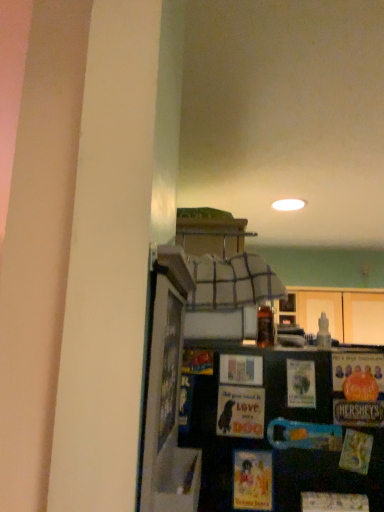
Question: Based on their sizes in the image, would you say matte paper postcard at center, arranged as the 1th postcard when viewed from the left, is bigger or smaller than matte paper postcard at center, marked as the 1th postcard in a right-to-left arrangement?

Choices:
 (A) small
 (B) big

Answer: (B)

Question: Is matte paper postcard at center, arranged as the 1th postcard when viewed from the left, taller or shorter than matte paper postcard at center, the 2th postcard in the left-to-right sequence?

Choices:
 (A) short
 (B) tall

Answer: (B)

Question: Which is nearer to the translucent glass bottle at upper center?

Choices:
 (A) matte paper postcard at center, arranged as the 1th postcard when viewed from the left
 (B) matte paper postcard at center, marked as the 1th postcard in a right-to-left arrangement

Answer: (A)

Question: Which object is the closest to the matte paper postcard at center, the 2th postcard in the left-to-right sequence?

Choices:
 (A) translucent glass bottle at upper center
 (B) matte paper postcard at center, which is the 2th postcard in right-to-left order

Answer: (B)